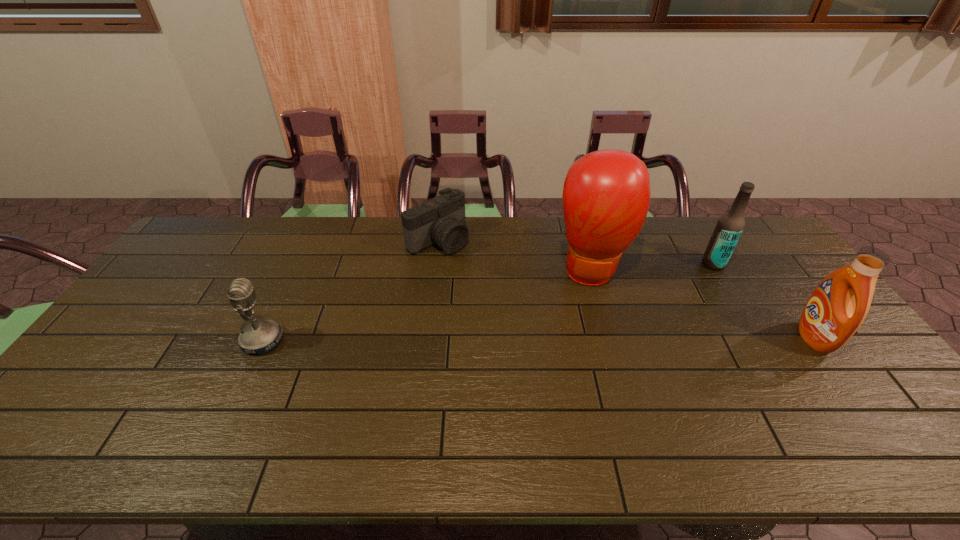
Where is `vacant area that satisfies the following two spatial constraints: 1. on the front side of the detergent; 2. on the front-facing side of the boxing glove`? vacant area that satisfies the following two spatial constraints: 1. on the front side of the detergent; 2. on the front-facing side of the boxing glove is located at coordinates (612, 338).

The width and height of the screenshot is (960, 540). I want to click on vacant space that satisfies the following two spatial constraints: 1. on the front side of the beer bottle; 2. on the left side of the camera, so click(x=436, y=264).